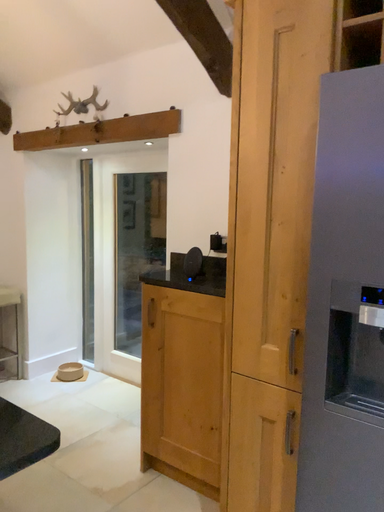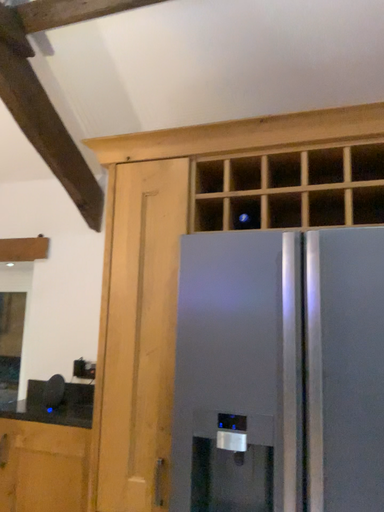
Question: How did the camera likely rotate when shooting the video?

Choices:
 (A) rotated downward
 (B) rotated upward

Answer: (B)